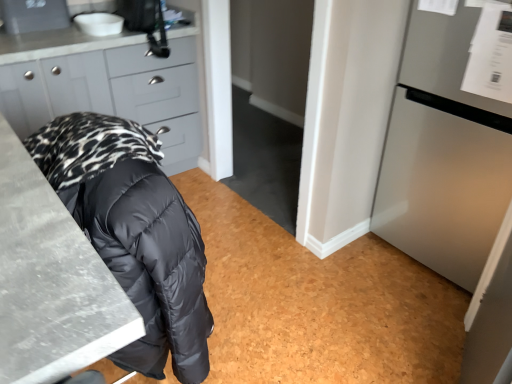
Question: From a real-world perspective, is marble gray countertop at lower left above or below white glossy sink at upper left?

Choices:
 (A) below
 (B) above

Answer: (A)

Question: Is marble gray countertop at lower left inside the boundaries of white glossy sink at upper left, or outside?

Choices:
 (A) outside
 (B) inside

Answer: (A)

Question: Which is farther from the white glossy sink at upper left?

Choices:
 (A) matte gray cabinets at upper left
 (B) satin silver refrigerator at right
 (C) marble gray countertop at lower left

Answer: (B)

Question: Which is farther from the matte gray cabinets at upper left?

Choices:
 (A) satin silver refrigerator at right
 (B) white glossy sink at upper left
 (C) marble gray countertop at lower left

Answer: (A)